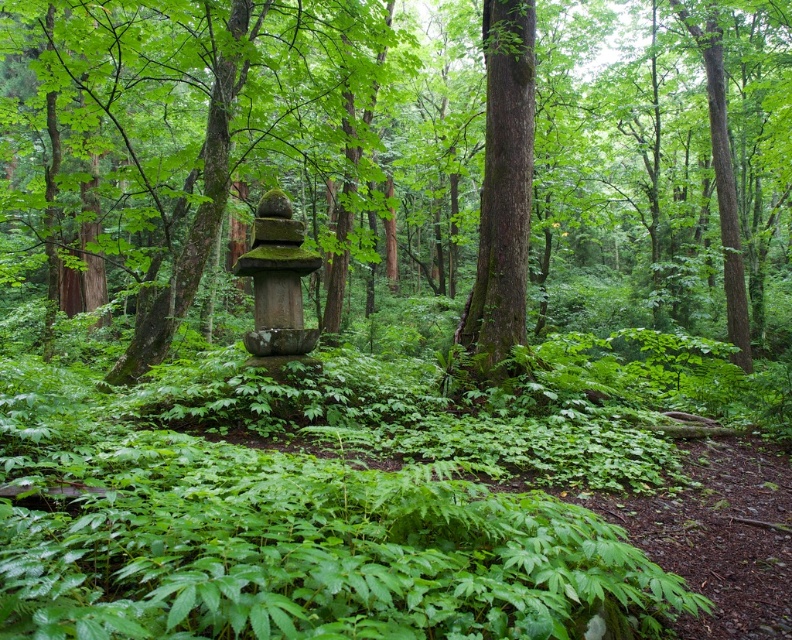
Question: Observing the image, what is the correct spatial positioning of green mossy stone statue at center in reference to smooth brown tree trunk at center?

Choices:
 (A) left
 (B) right

Answer: (B)

Question: Can you confirm if green mossy stone statue at center is positioned above smooth brown tree trunk at center?

Choices:
 (A) no
 (B) yes

Answer: (B)

Question: Is green mossy stone statue at center positioned behind smooth brown tree trunk at center?

Choices:
 (A) no
 (B) yes

Answer: (A)